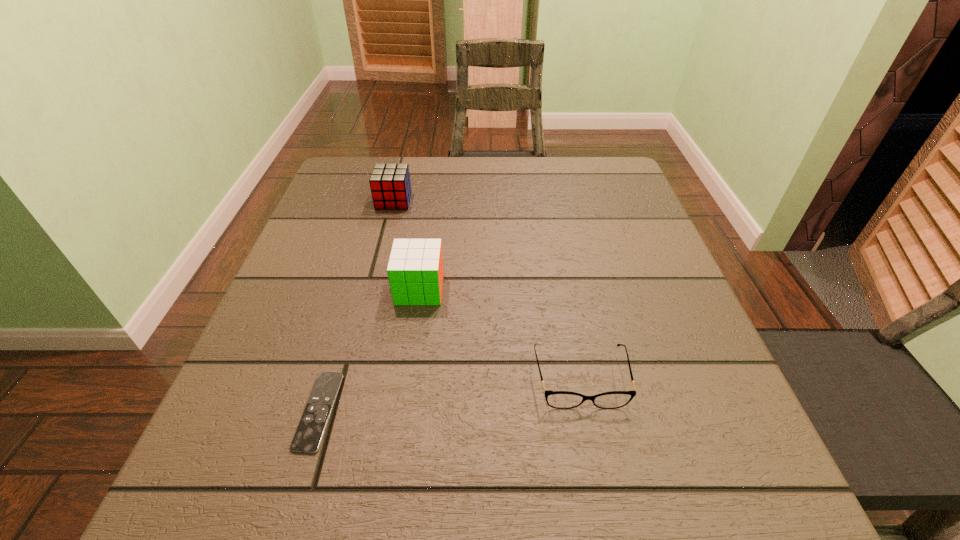
Locate an element on the screen. vacant space at the far left corner of the desktop is located at coordinates (331, 200).

Image resolution: width=960 pixels, height=540 pixels. Find the location of `vacant space at the near left corner of the desktop`. vacant space at the near left corner of the desktop is located at coordinates (232, 467).

Find the location of a particular element. This screenshot has width=960, height=540. vacant region at the far right corner of the desktop is located at coordinates (588, 171).

Where is `free space between the left cube and the rightmost object`? free space between the left cube and the rightmost object is located at coordinates (487, 289).

The height and width of the screenshot is (540, 960). I want to click on free space between the second object from right to left and the third tallest object, so click(x=500, y=334).

Identify the location of empty space between the right cube and the shortest object. This screenshot has width=960, height=540. (370, 350).

Where is `free area in between the remote control and the second object from right to left`? This screenshot has height=540, width=960. free area in between the remote control and the second object from right to left is located at coordinates (370, 350).

Where is `free space between the nearer cube and the rightmost object`? This screenshot has height=540, width=960. free space between the nearer cube and the rightmost object is located at coordinates (500, 334).

This screenshot has height=540, width=960. In order to click on vacant space that's between the left cube and the shortest object in this screenshot , I will do `click(356, 306)`.

Locate an element on the screen. The image size is (960, 540). free space between the shortest object and the third nearest object is located at coordinates (370, 350).